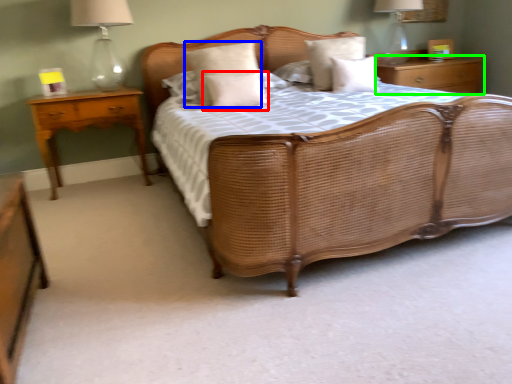
Question: Based on their relative distances, which object is nearer to pillow (highlighted by a red box)? Choose from pillow (highlighted by a blue box) and nightstand (highlighted by a green box).

Choices:
 (A) pillow
 (B) nightstand

Answer: (A)